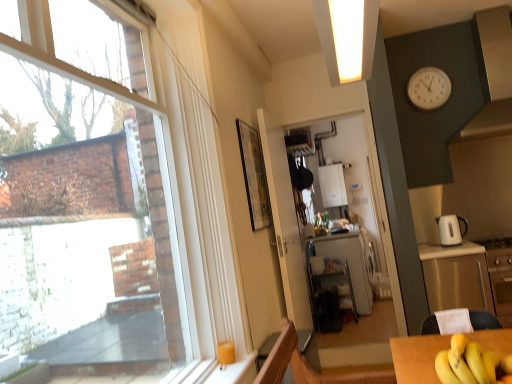
Where is `vacant space situated above white plastic clock at upper right (from a real-world perspective)`? This screenshot has height=384, width=512. vacant space situated above white plastic clock at upper right (from a real-world perspective) is located at coordinates (423, 62).